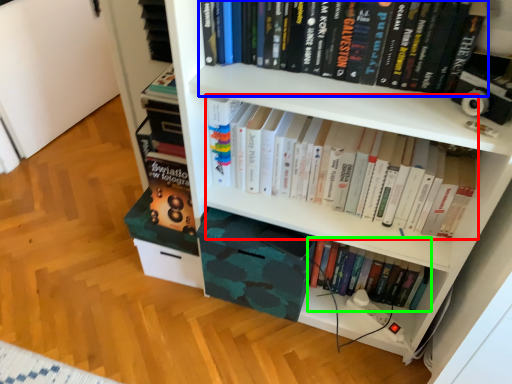
Question: Based on their relative distances, which object is farther from book (highlighted by a red box)? Choose from book (highlighted by a blue box) and book (highlighted by a green box).

Choices:
 (A) book
 (B) book

Answer: (B)